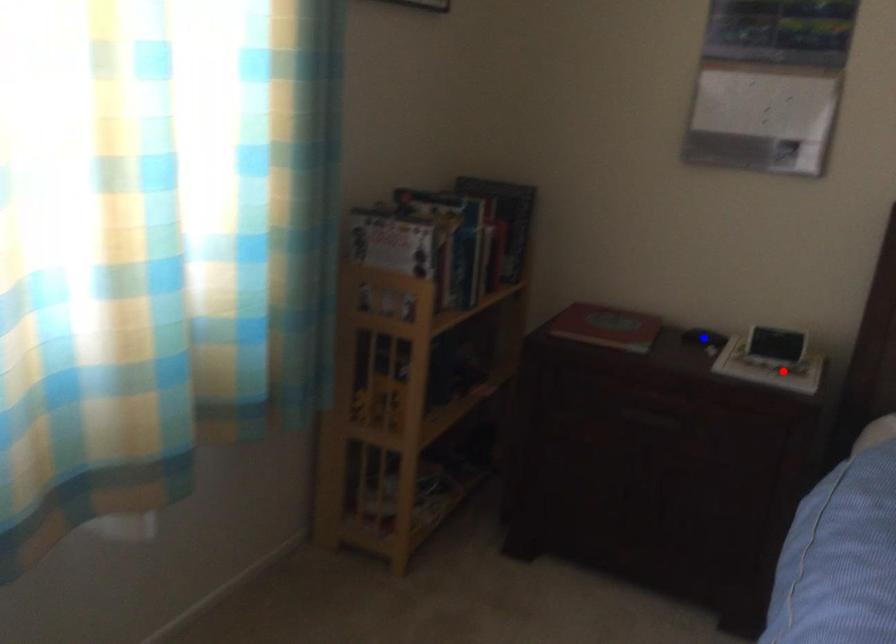
Question: In the image, two points are highlighted. Which point is nearer to the camera? Reply with the corresponding letter.

Choices:
 (A) blue point
 (B) red point

Answer: (B)